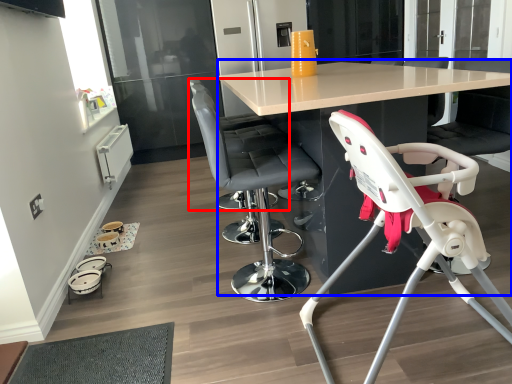
Question: Which object is further to the camera taking this photo, chair (highlighted by a red box) or table (highlighted by a blue box)?

Choices:
 (A) chair
 (B) table

Answer: (A)